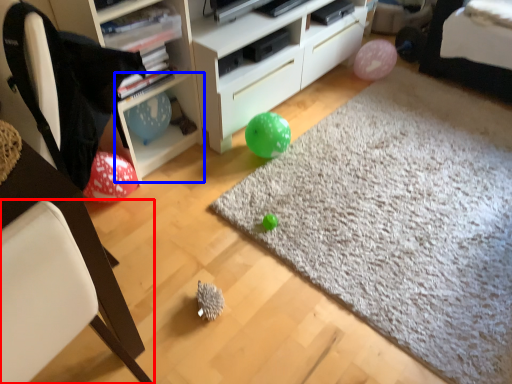
Question: Which of the following is the farthest to the observer, chair (highlighted by a red box) or cabinet (highlighted by a blue box)?

Choices:
 (A) chair
 (B) cabinet

Answer: (B)